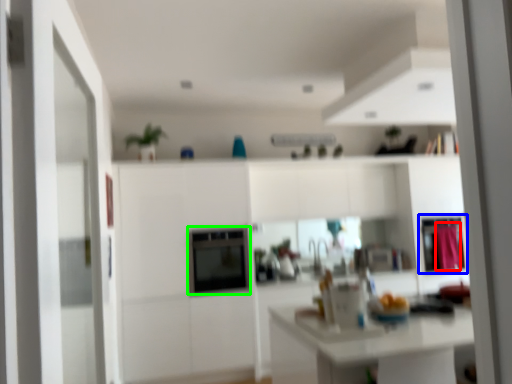
Question: Which object is positioned closest to curtain (highlighted by a red box)? Select from cabinetry (highlighted by a blue box) and appliance (highlighted by a green box).

Choices:
 (A) cabinetry
 (B) appliance

Answer: (A)